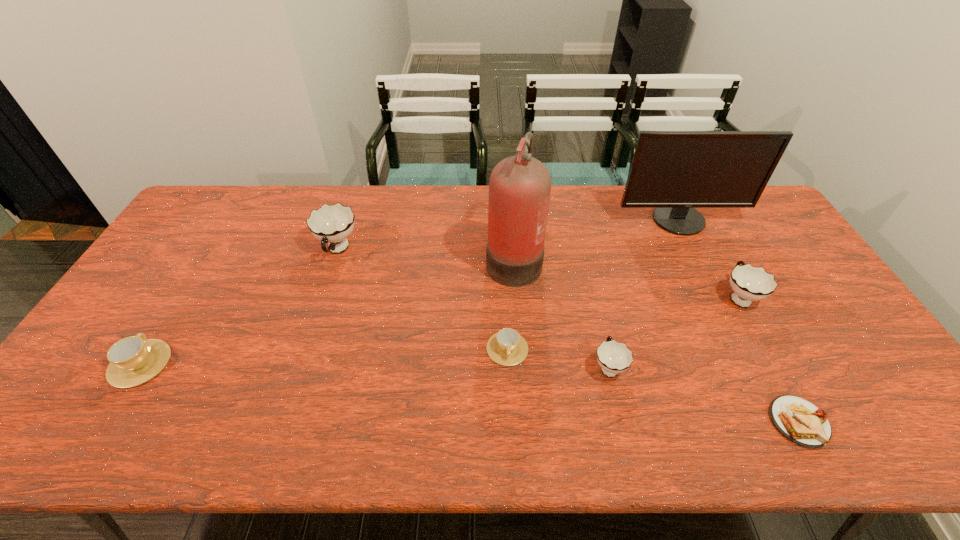
Locate which object ranks fifth in proximity to the fire extinguisher. Please provide its 2D coordinates. Your answer should be formatted as a tuple, i.e. [(x, y)], where the tuple contains the x and y coordinates of a point satisfying the conditions above.

[(749, 283)]

Identify which object is located as the seventh nearest to the tallest object. Please provide its 2D coordinates. Your answer should be formatted as a tuple, i.e. [(x, y)], where the tuple contains the x and y coordinates of a point satisfying the conditions above.

[(133, 360)]

Select which cup is the closest to the seventh shortest object. Please provide its 2D coordinates. Your answer should be formatted as a tuple, i.e. [(x, y)], where the tuple contains the x and y coordinates of a point satisfying the conditions above.

[(749, 283)]

Identify the location of cup that is the closest one to the fire extinguisher. (507, 347).

I want to click on white cup that is the nearest to the second white cup from left to right, so click(x=749, y=283).

Where is `white cup that is the closest to the second tallest cup`? Image resolution: width=960 pixels, height=540 pixels. white cup that is the closest to the second tallest cup is located at coordinates (614, 357).

Find the location of a particular element. This screenshot has height=540, width=960. vacant space that satisfies the following two spatial constraints: 1. on the side of the smallest white cup with the handle; 2. at the nozzle of the tallest object is located at coordinates (x=583, y=259).

The height and width of the screenshot is (540, 960). I want to click on free space that satisfies the following two spatial constraints: 1. on the screen side of the monitor; 2. at the nozzle of the fire extinguisher, so click(697, 259).

Where is `vacant space that satisfies the following two spatial constraints: 1. at the nozzle of the fire extinguisher; 2. on the side of the rightmost cup with the handle`? vacant space that satisfies the following two spatial constraints: 1. at the nozzle of the fire extinguisher; 2. on the side of the rightmost cup with the handle is located at coordinates (516, 297).

Locate an element on the screen. This screenshot has width=960, height=540. free spot that satisfies the following two spatial constraints: 1. on the side of the sixth shortest object with the handle; 2. on the right side of the shortest object is located at coordinates (280, 422).